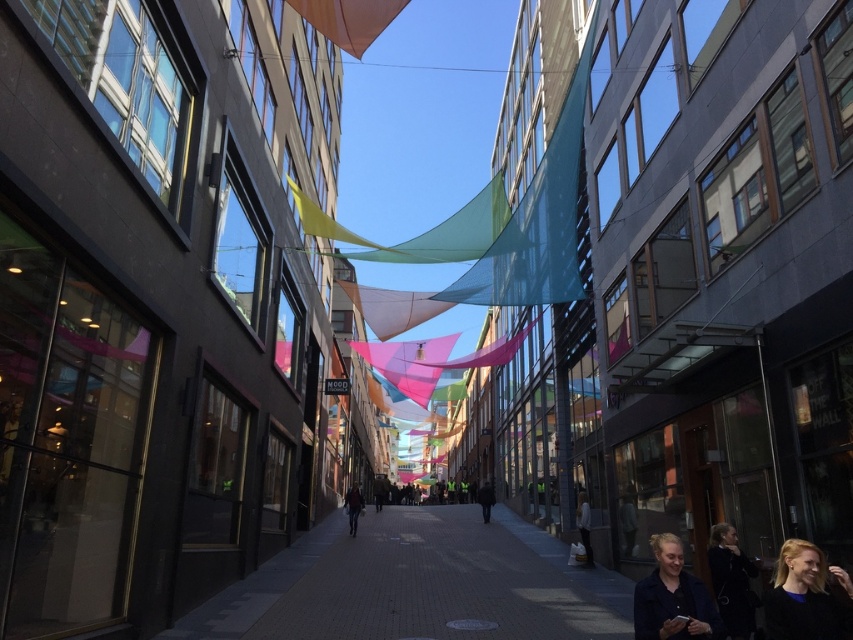
Is dark blue jacket at lower right thinner than dark gray sweater at lower right?

Yes, dark blue jacket at lower right is thinner than dark gray sweater at lower right.

Looking at this image, which is more to the left, dark blue jacket at lower right or dark gray sweater at lower right?

Positioned to the left is dark blue jacket at lower right.

Is point (646, 616) positioned before point (747, 625)?

Yes, it is.

Where is `dark blue jacket at lower right`? The image size is (853, 640). dark blue jacket at lower right is located at coordinates (671, 596).

Does point (735, 552) lie behind point (352, 488)?

No, it is in front of (352, 488).

Does dark gray sweater at lower right appear on the right side of dark blue jeans at center?

Correct, you'll find dark gray sweater at lower right to the right of dark blue jeans at center.

The width and height of the screenshot is (853, 640). Describe the element at coordinates (730, 580) in the screenshot. I see `dark gray sweater at lower right` at that location.

Where is `dark gray sweater at lower right`? dark gray sweater at lower right is located at coordinates (730, 580).

Can you confirm if blonde hair at lower right is wider than dark blue jeans at center?

Incorrect, blonde hair at lower right's width does not surpass dark blue jeans at center's.

Does blonde hair at lower right lie behind dark blue jeans at center?

That is False.

Locate an element on the screen. The height and width of the screenshot is (640, 853). blonde hair at lower right is located at coordinates (804, 596).